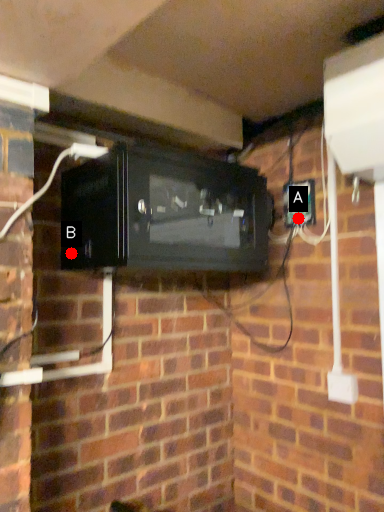
Question: Two points are circled on the image, labeled by A and B beside each circle. Which of the following is the closest to the observer?

Choices:
 (A) A is closer
 (B) B is closer

Answer: (B)